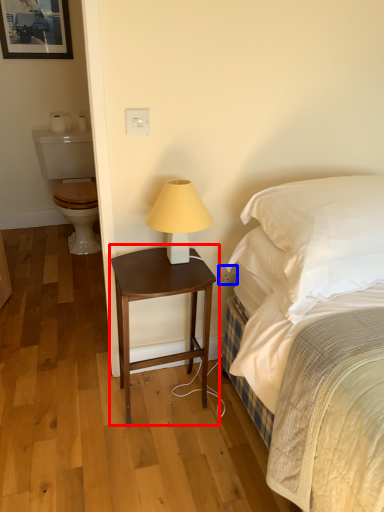
Question: Among these objects, which one is nearest to the camera, nightstand (highlighted by a red box) or electric outlet (highlighted by a blue box)?

Choices:
 (A) nightstand
 (B) electric outlet

Answer: (A)